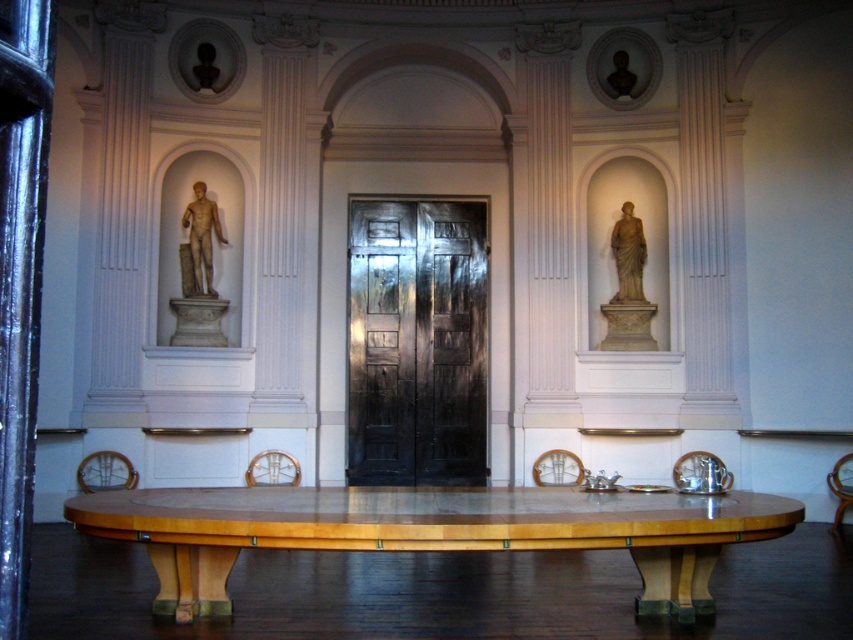
You are an interior designer planning to move a large sofa through the black polished wood door at center. The sofa is 1.8 meters wide. Can you fit the sofa through the door if the light wood table at center is 2 meters wide?

The light wood table at center is wider than the black polished wood door at center. Since the table is 2 meters wide, the door must be narrower than 2 meters. The sofa is 1.8 meters wide, which is narrower than the door, so it should fit.

You are standing in the center of the room and want to move towards the two points marked in the image. Which point, point (454,509) or point (393,296), is closer to you?

Point (454,509) is in front of point (393,296), so it is closer to you.